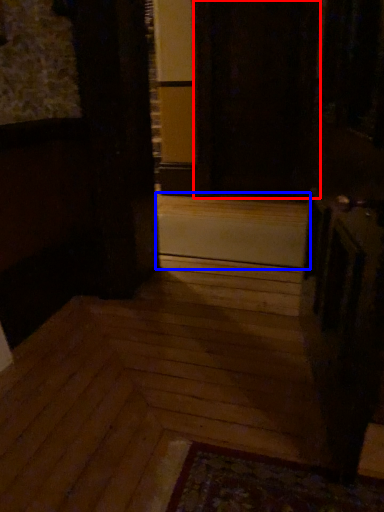
Question: Among these objects, which one is farthest to the camera, screen door (highlighted by a red box) or stairwell (highlighted by a blue box)?

Choices:
 (A) screen door
 (B) stairwell

Answer: (A)